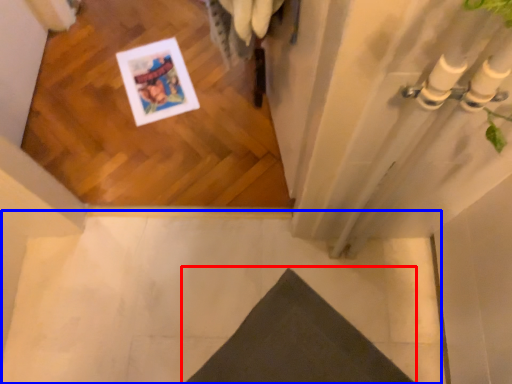
Question: Which object is further to the camera taking this photo, doormat (highlighted by a red box) or concrete (highlighted by a blue box)?

Choices:
 (A) doormat
 (B) concrete

Answer: (B)